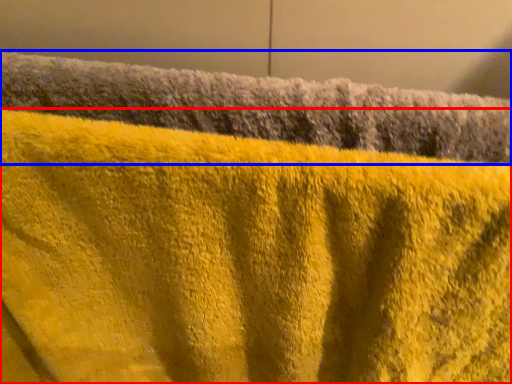
Question: Which point is further to the camera, towel (highlighted by a red box) or towel (highlighted by a blue box)?

Choices:
 (A) towel
 (B) towel

Answer: (B)